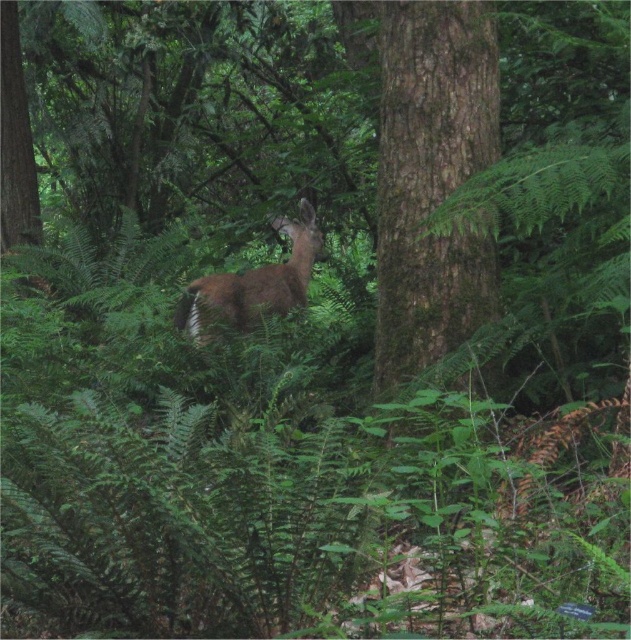
In the scene shown: You are a hiker who wants to locate the brown rough bark tree at center in the forest. Based on the coordinates given, can you determine its exact location in the scene?

The brown rough bark tree at center is located at coordinates point (427, 172).

You are a hiker who wants to take a photo of the brown furry deer at center without getting too close. If your camera has a maximum zoom range of 2 meters, can you capture the deer clearly from your current position near the brown rough bark tree at center?

The brown rough bark tree at center is 2.28 meters away from the brown furry deer at center. Since your camera can only zoom up to 2 meters, you are slightly too far away to capture the deer clearly without moving closer.

You are a hiker who wants to take a photo of the brown furry deer at center without including the brown rough bark tree at center in the frame. Is it possible to adjust your camera angle to achieve this?

The brown rough bark tree at center is above the brown furry deer at center, so if you lower your camera angle to focus on the deer below, you can avoid capturing the tree in the frame.